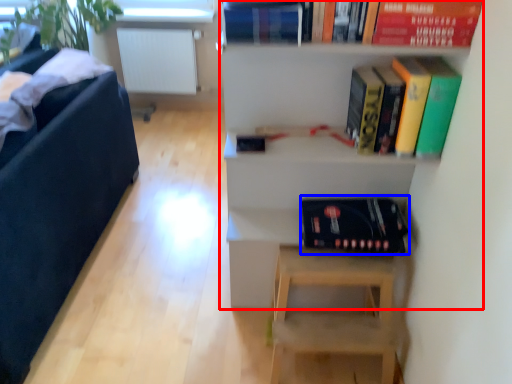
Question: Which object appears farthest to the camera in this image, shelf (highlighted by a red box) or album (highlighted by a blue box)?

Choices:
 (A) shelf
 (B) album

Answer: (B)